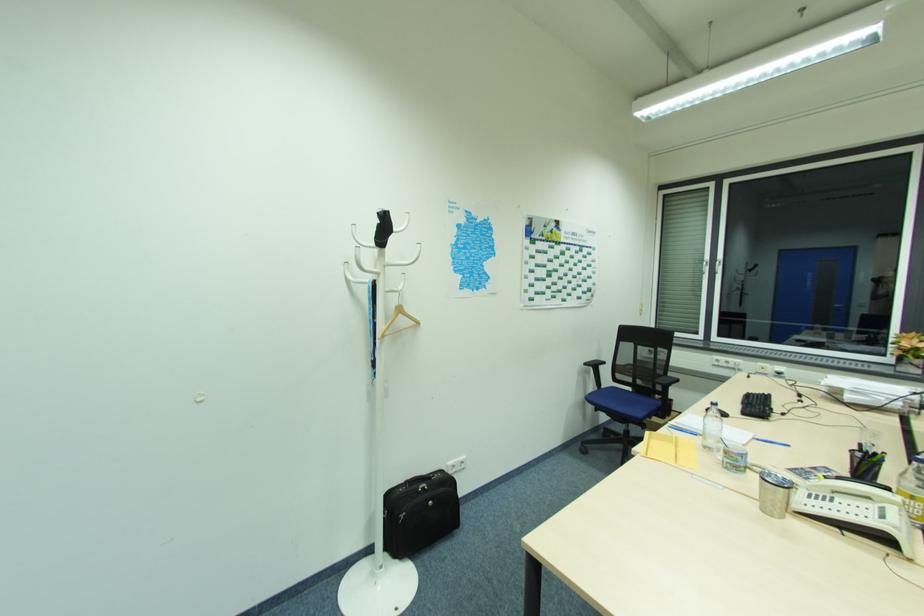
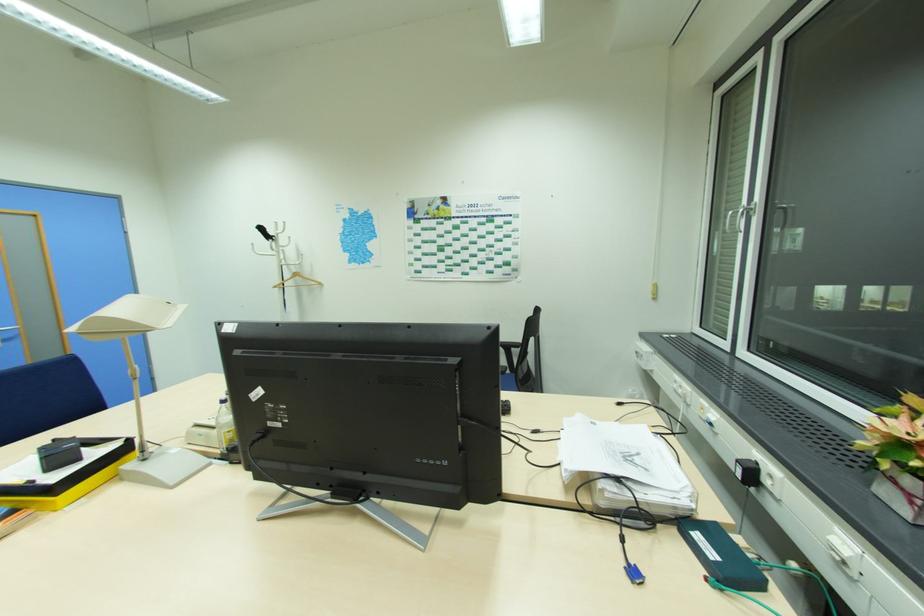
The point at (708, 262) is marked in the first image. Where is the corresponding point in the second image?

(733, 213)